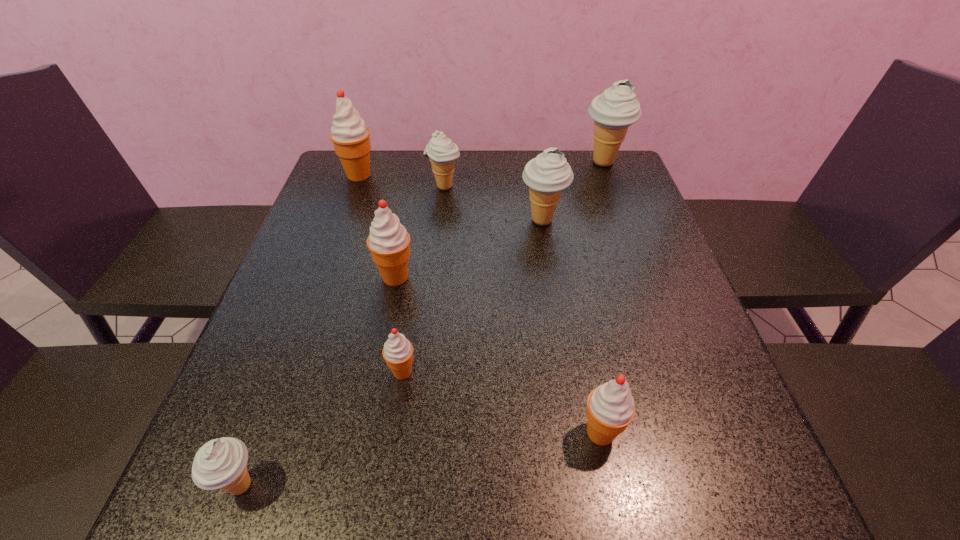
The height and width of the screenshot is (540, 960). Identify the location of vacant area that lies between the fifth farthest icecream and the rightmost icecream. (499, 220).

Locate an element on the screen. The width and height of the screenshot is (960, 540). unoccupied area between the sixth farthest icecream and the second nearest beige icecream is located at coordinates (472, 296).

The width and height of the screenshot is (960, 540). What are the coordinates of `free space between the second farthest red icecream and the second nearest icecream` in the screenshot? It's located at (498, 355).

In order to click on vacant area between the fourth farthest object and the second nearest object in this screenshot , I will do `click(571, 326)`.

The image size is (960, 540). In order to click on unoccupied area between the third beige icecream from left to right and the third farthest red icecream in this screenshot , I will do `click(472, 296)`.

Point out which object is positioned as the sixth nearest to the second nearest red icecream. Please provide its 2D coordinates. Your answer should be formatted as a tuple, i.e. [(x, y)], where the tuple contains the x and y coordinates of a point satisfying the conditions above.

[(350, 136)]

You are a GUI agent. You are given a task and a screenshot of the screen. Output one action in this format:
    pyautogui.click(x=<x>, y=<y>)
    Task: Click on the object identified as the fourth closest to the third smallest red icecream
    The width and height of the screenshot is (960, 540).
    Given the screenshot: What is the action you would take?
    pyautogui.click(x=350, y=136)

Point out which icecream is positioned as the seventh nearest to the third nearest icecream. Please provide its 2D coordinates. Your answer should be formatted as a tuple, i.e. [(x, y)], where the tuple contains the x and y coordinates of a point satisfying the conditions above.

[(613, 111)]

I want to click on icecream that is the second closest to the rightmost beige icecream, so click(442, 152).

Locate an element on the screen. The height and width of the screenshot is (540, 960). beige icecream that is the second closest to the nearest beige icecream is located at coordinates (442, 152).